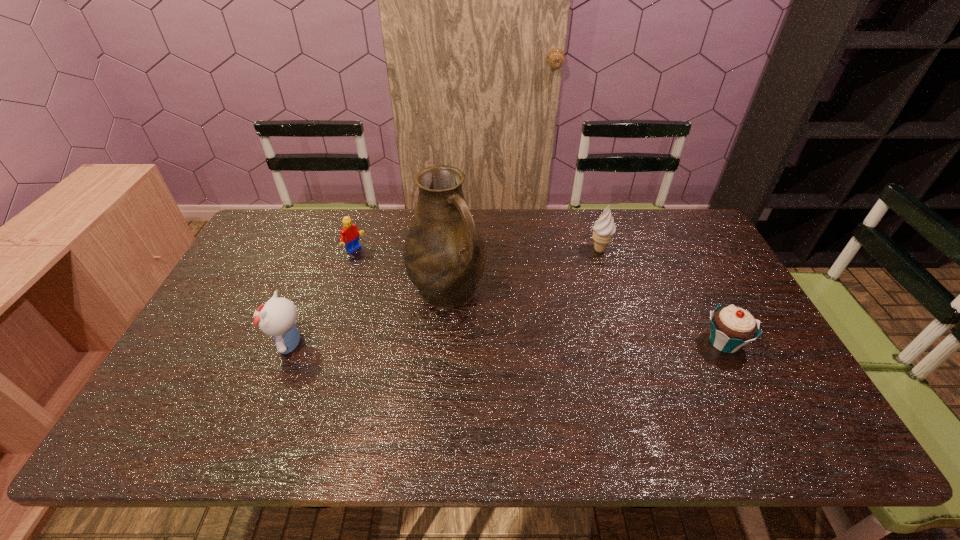
You are a GUI agent. You are given a task and a screenshot of the screen. Output one action in this format:
    pyautogui.click(x=<x>, y=<y>)
    Task: Click on the kitten
    The image size is (960, 540).
    Given the screenshot: What is the action you would take?
    pyautogui.click(x=277, y=318)

Where is `the rightmost object`? the rightmost object is located at coordinates (732, 327).

This screenshot has width=960, height=540. Identify the location of the fourth object from left to right. (604, 228).

Locate an element on the screen. This screenshot has height=540, width=960. Lego is located at coordinates (349, 236).

At what (x,y) coordinates should I click in order to perform the action: click on the third farthest object. Please return your answer as a coordinate pair (x, y). This screenshot has width=960, height=540. Looking at the image, I should click on (444, 254).

At what (x,y) coordinates should I click in order to perform the action: click on the tallest object. Please return your answer as a coordinate pair (x, y). Looking at the image, I should click on point(444,254).

Where is `vacant space located 0.180m on the front-facing side of the kitten`? The width and height of the screenshot is (960, 540). vacant space located 0.180m on the front-facing side of the kitten is located at coordinates (204, 344).

This screenshot has height=540, width=960. I want to click on vacant area located on the front-facing side of the kitten, so click(215, 344).

Locate an element on the screen. The height and width of the screenshot is (540, 960). free region located 0.220m on the front-facing side of the kitten is located at coordinates (188, 344).

At what (x,y) coordinates should I click in order to perform the action: click on vacant region located on the left of the cupcake. Please return your answer as a coordinate pair (x, y). This screenshot has height=540, width=960. Looking at the image, I should click on (643, 343).